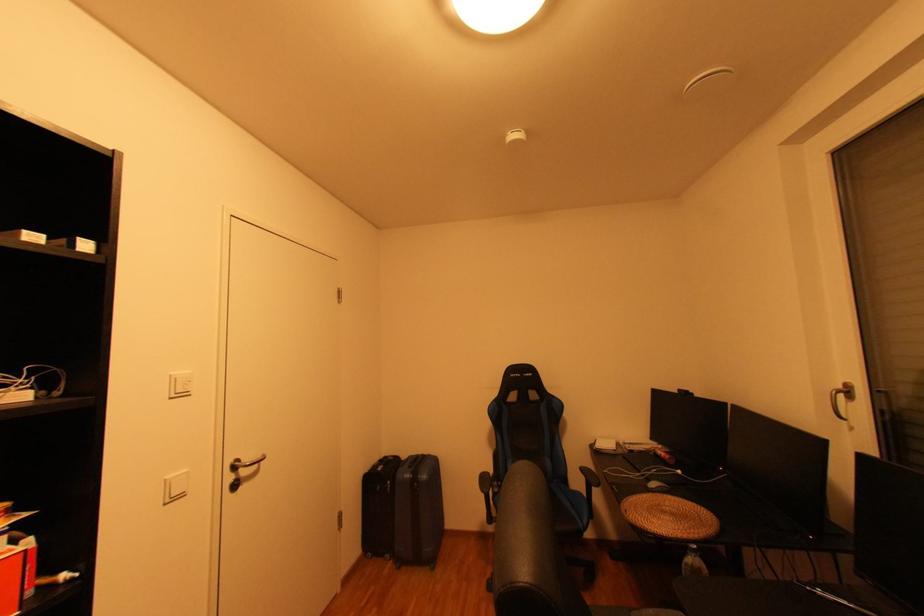
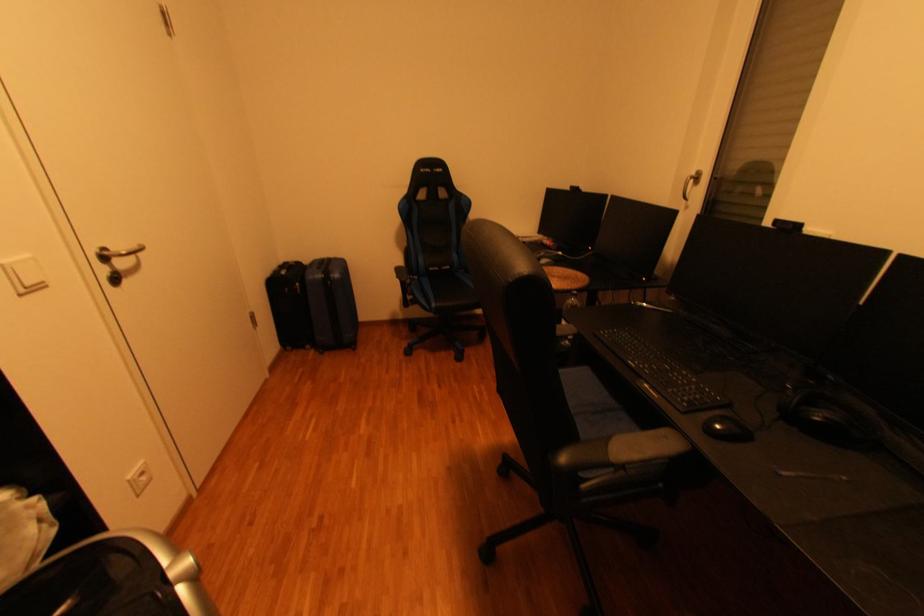
The first image is from the beginning of the video and the second image is from the end. How did the camera likely rotate when shooting the video?

The camera's rotation is toward right-down.